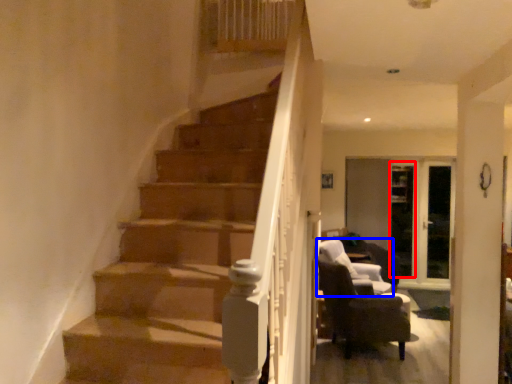
Question: Which of the following is the farthest to the observer, glass door (highlighted by a red box) or chair (highlighted by a blue box)?

Choices:
 (A) glass door
 (B) chair

Answer: (A)